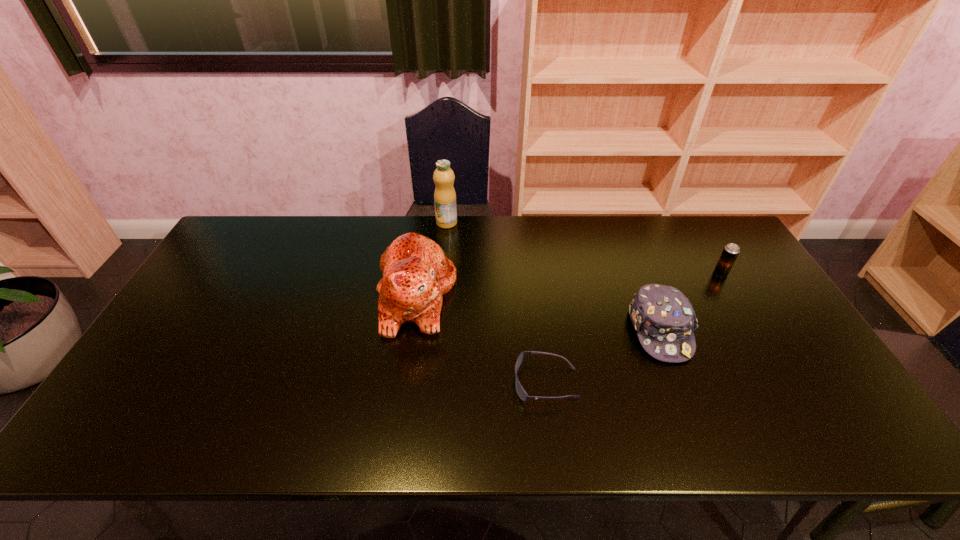
Identify the location of free space between the fruit juice and the rightmost object. (584, 248).

At what (x,y) coordinates should I click in order to perform the action: click on free spot between the beer can and the second object from right to left. Please return your answer as a coordinate pair (x, y). Image resolution: width=960 pixels, height=540 pixels. Looking at the image, I should click on (690, 301).

Point out which object is positioned as the second nearest to the cat. Please provide its 2D coordinates. Your answer should be formatted as a tuple, i.e. [(x, y)], where the tuple contains the x and y coordinates of a point satisfying the conditions above.

[(522, 394)]

Where is `object that is the closest to the rightmost object`? The width and height of the screenshot is (960, 540). object that is the closest to the rightmost object is located at coordinates (665, 321).

Locate an element on the screen. This screenshot has height=540, width=960. free space that satisfies the following two spatial constraints: 1. on the front label of the farthest object; 2. on the face of the cat is located at coordinates (440, 296).

Identify the location of vacant position in the image that satisfies the following two spatial constraints: 1. on the front label of the farthest object; 2. on the face of the cat. (440, 296).

The height and width of the screenshot is (540, 960). What are the coordinates of `vacant space that satisfies the following two spatial constraints: 1. on the front label of the fruit juice; 2. on the face of the cat` in the screenshot? It's located at (440, 296).